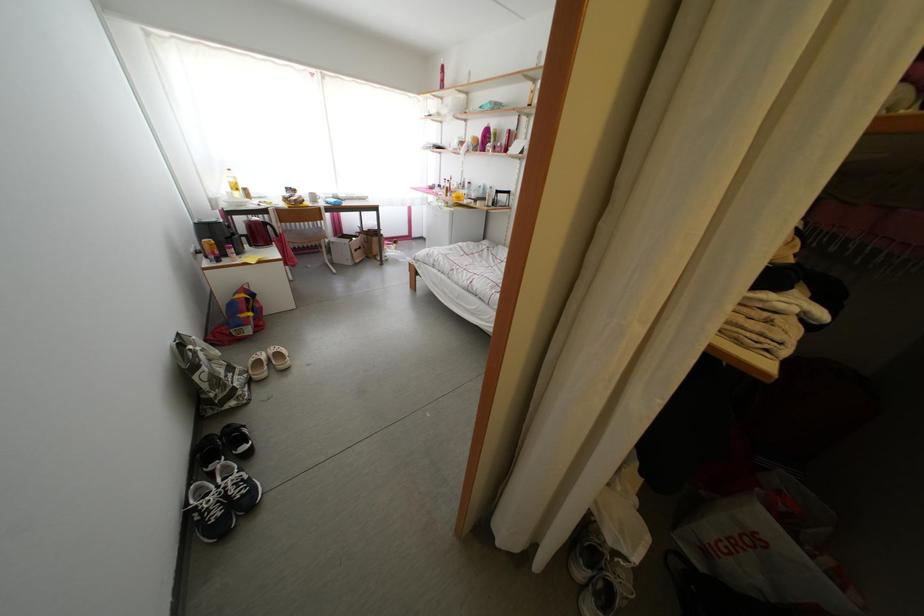
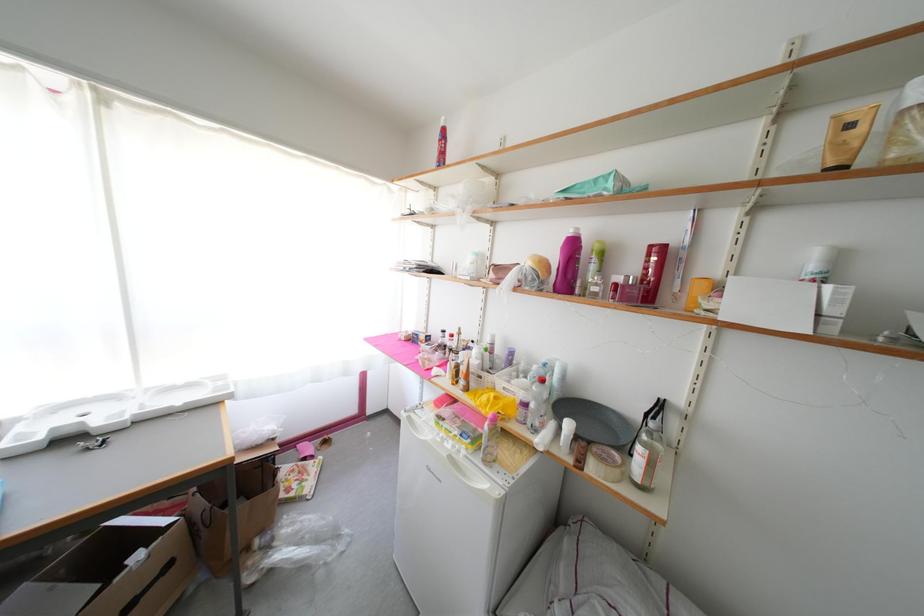
Question: In a continuous first-person perspective shot, in which direction is the camera moving?

Choices:
 (A) Left
 (B) Right
 (C) Forward
 (D) Backward

Answer: (C)